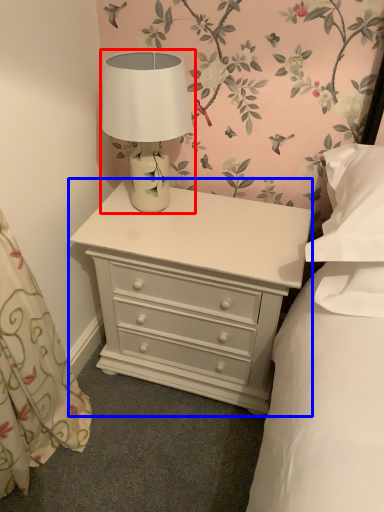
Question: Which object appears farthest to the camera in this image, table lamp (highlighted by a red box) or nightstand (highlighted by a blue box)?

Choices:
 (A) table lamp
 (B) nightstand

Answer: (B)